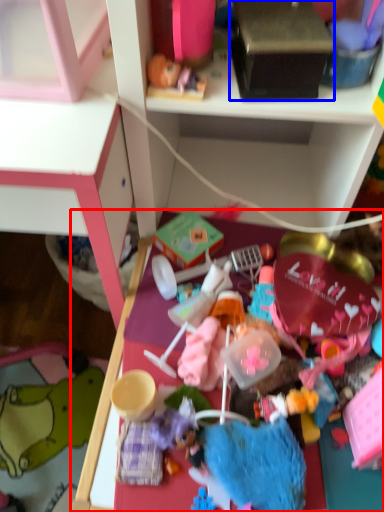
Question: Which object appears farthest to the camera in this image, table (highlighted by a red box) or box (highlighted by a blue box)?

Choices:
 (A) table
 (B) box

Answer: (B)